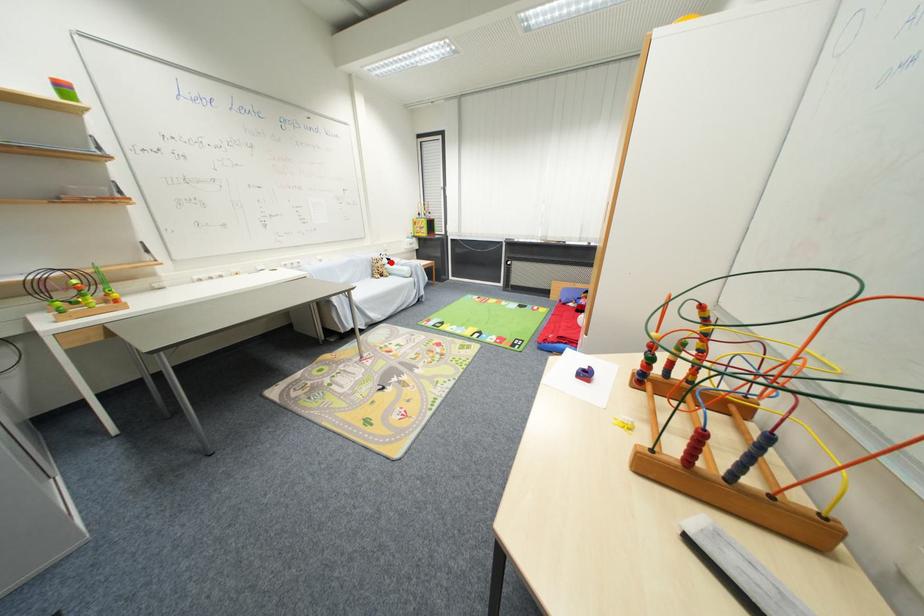
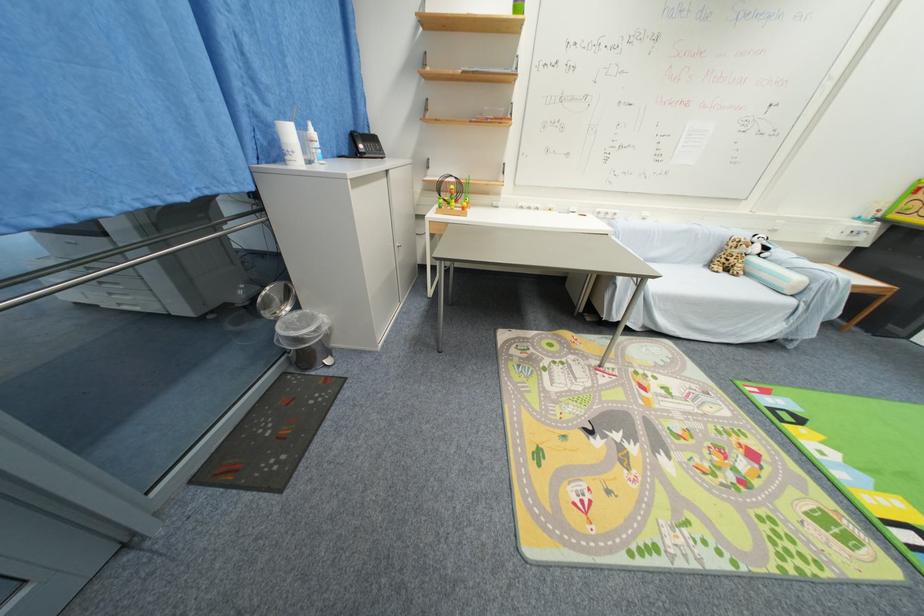
Question: I am providing you with two images of the same scene from different viewpoints. Given a red point in image1, look at the same physical point in image2. Is it:

Choices:
 (A) Closer to the viewpoint
 (B) Farther from the viewpoint

Answer: (B)